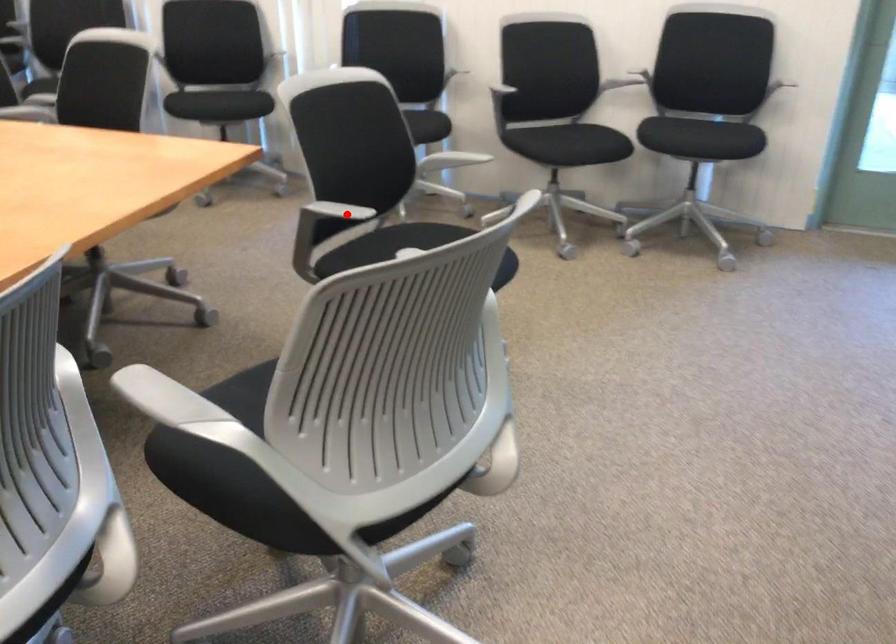
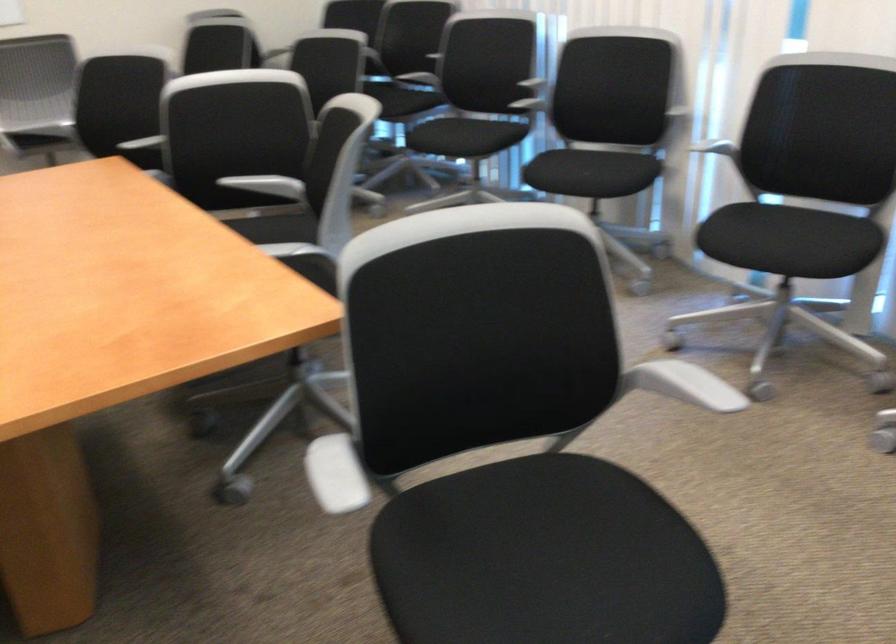
Question: I am providing you with two images of the same scene from different viewpoints. A red point is marked on the first image. Can you still see the location of the red point in image 2?

Choices:
 (A) Yes
 (B) No

Answer: (A)